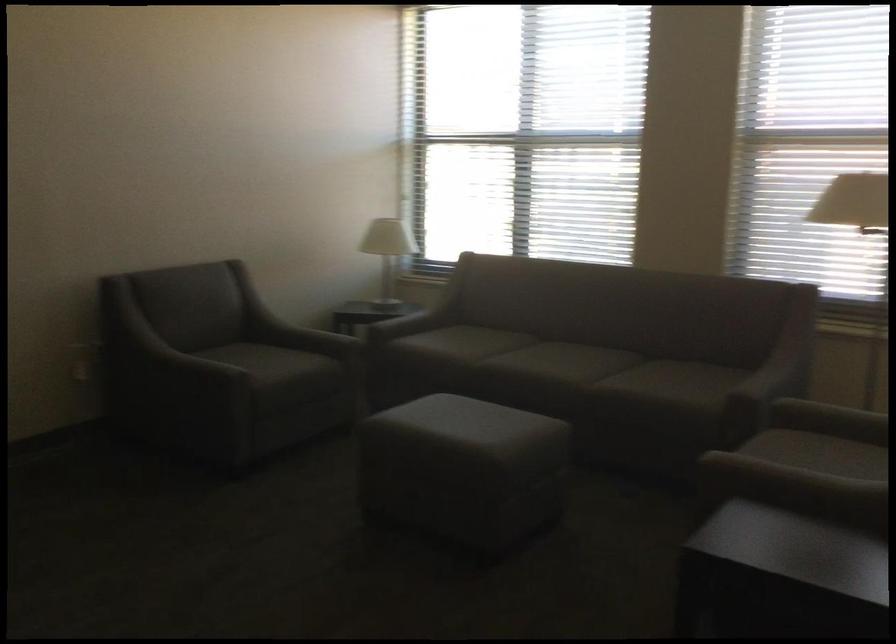
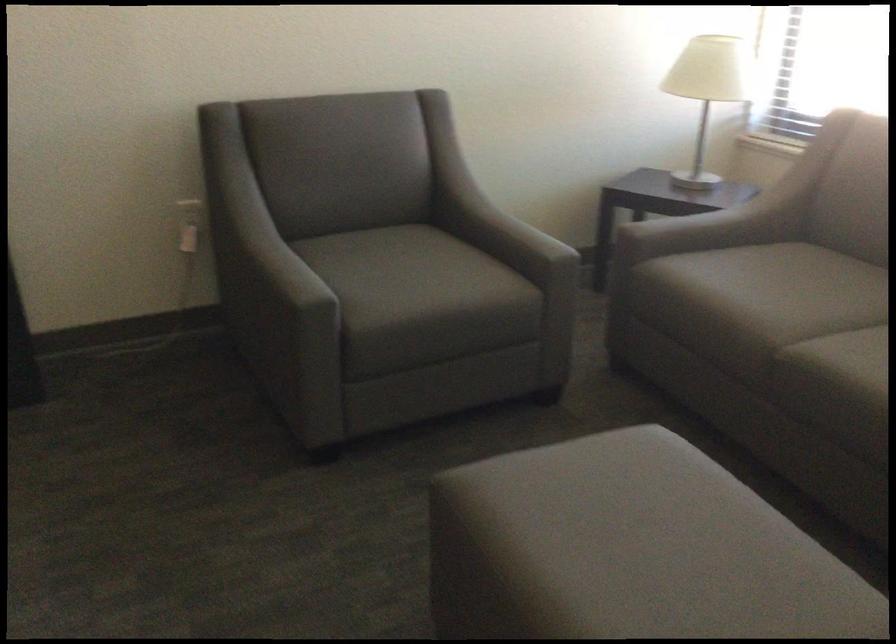
In the second image, find the point that corresponds to pixel 195 357 in the first image.

(281, 265)